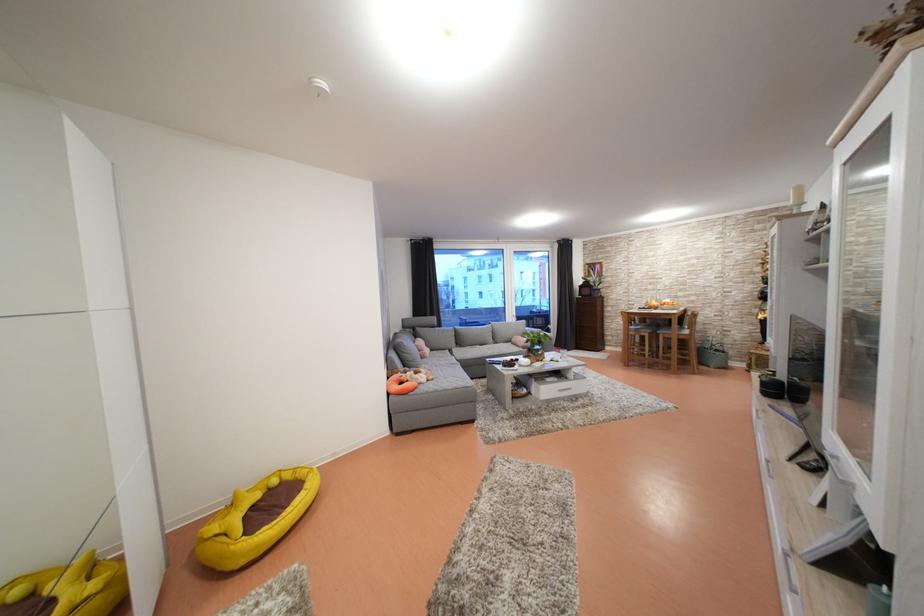
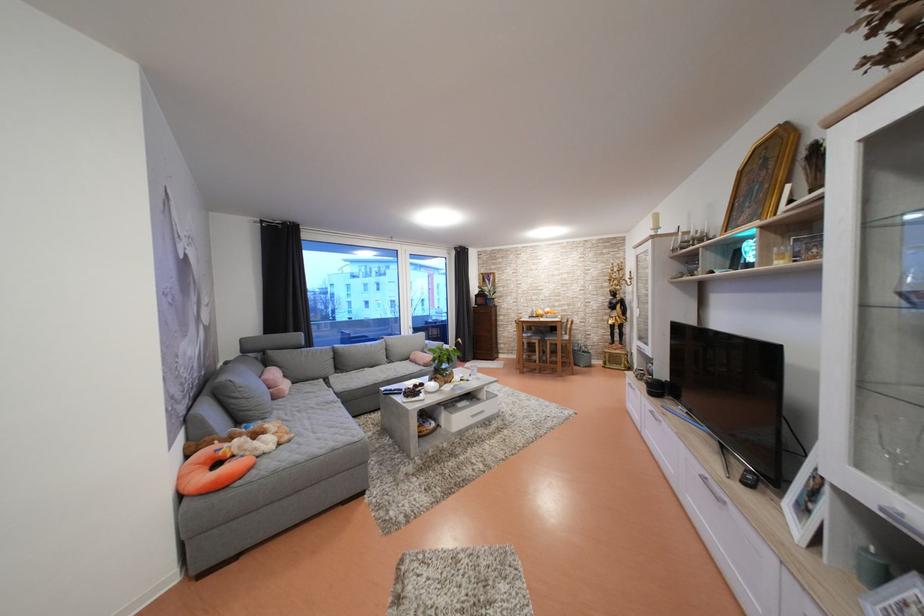
Where in the second image is the point corresponding to pixel 657 336 from the first image?

(545, 342)